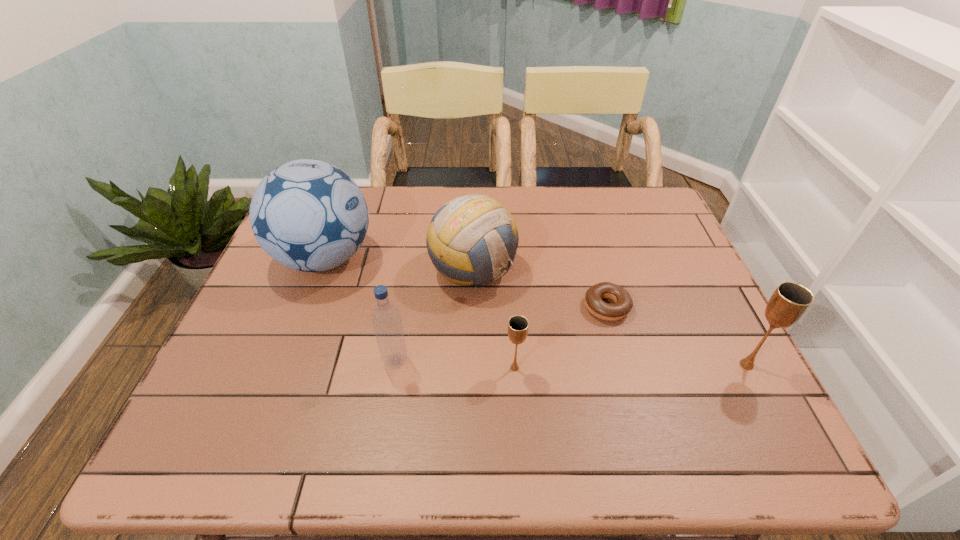
Where is `vacant region located 0.130m on the left of the left chalice`? This screenshot has width=960, height=540. vacant region located 0.130m on the left of the left chalice is located at coordinates (445, 368).

This screenshot has width=960, height=540. Identify the location of free space located on the back of the taller chalice. (715, 303).

Where is `free region located on the right of the volleyball`? free region located on the right of the volleyball is located at coordinates click(x=655, y=269).

Locate an element on the screen. free spot located on the back of the shortest object is located at coordinates 588,241.

Identify the location of vacant point located 0.230m on the side with brand of the soccer ball. (460, 259).

Locate an element on the screen. The height and width of the screenshot is (540, 960). vacant space located on the front of the water bottle is located at coordinates (389, 402).

Where is `object present at the far edge`? The height and width of the screenshot is (540, 960). object present at the far edge is located at coordinates (308, 215).

Locate an element on the screen. The width and height of the screenshot is (960, 540). object located in the left edge section of the desktop is located at coordinates (308, 215).

Where is `object located at the right edge`? The width and height of the screenshot is (960, 540). object located at the right edge is located at coordinates (789, 302).

You are a GUI agent. You are given a task and a screenshot of the screen. Output one action in this format:
    pyautogui.click(x=<x>, y=<y>)
    Task: Click on the object that is at the far left corner
    The image size is (960, 540).
    Given the screenshot: What is the action you would take?
    pyautogui.click(x=308, y=215)